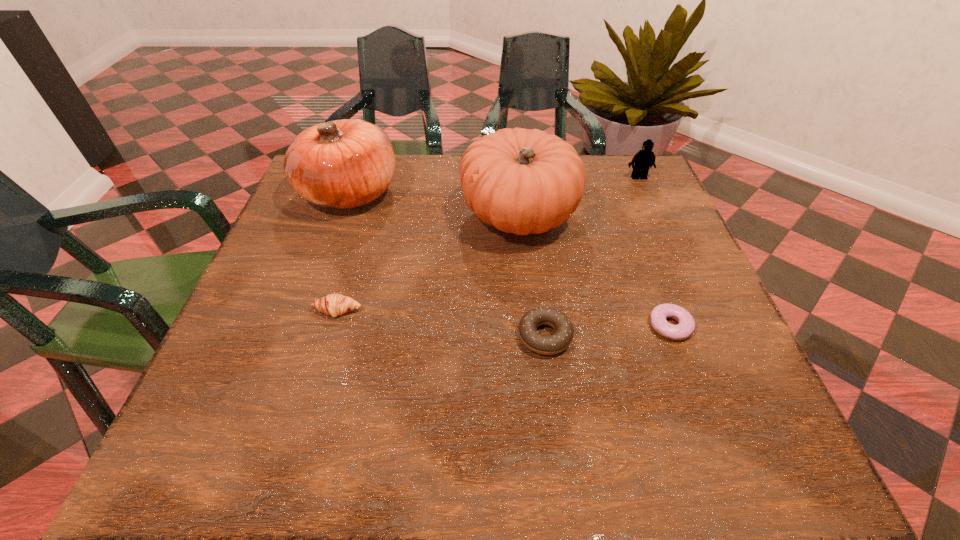
In order to click on vacant space located on the front-facing side of the pastry in this screenshot , I will do `click(300, 442)`.

Where is `free region located 0.120m on the back of the taller doughnut`? The height and width of the screenshot is (540, 960). free region located 0.120m on the back of the taller doughnut is located at coordinates (537, 271).

At what (x,y) coordinates should I click in order to perform the action: click on free space located 0.210m on the back of the right doughnut. Please return your answer as a coordinate pair (x, y). Looking at the image, I should click on point(637,239).

Identify the location of Lego that is at the far edge. This screenshot has width=960, height=540. (644, 159).

Where is `pumpkin situated at the left edge`? This screenshot has width=960, height=540. pumpkin situated at the left edge is located at coordinates (342, 164).

You are a GUI agent. You are given a task and a screenshot of the screen. Output one action in this format:
    pyautogui.click(x=<x>, y=<y>)
    Task: Click on the pastry present at the left edge
    
    Given the screenshot: What is the action you would take?
    pyautogui.click(x=334, y=305)

Locate an element on the screen. The image size is (960, 540). Lego that is positioned at the right edge is located at coordinates (644, 159).

Find the location of `doughnut positioned at the right edge`. doughnut positioned at the right edge is located at coordinates (686, 325).

This screenshot has height=540, width=960. Find the location of `object that is at the far left corner`. object that is at the far left corner is located at coordinates (342, 164).

Find the location of a particular element. The image size is (960, 540). object at the far right corner is located at coordinates point(644,159).